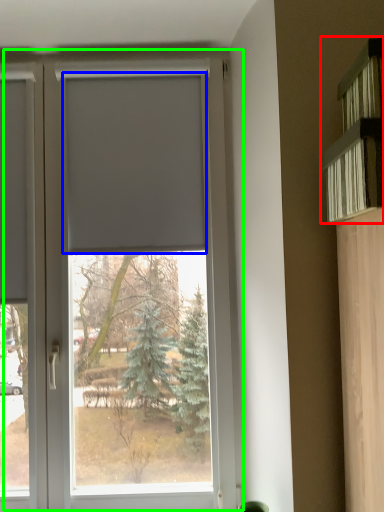
Question: Which object is the farthest from shelf (highlighted by a red box)? Choose among these: blind (highlighted by a blue box) or window (highlighted by a green box).

Choices:
 (A) blind
 (B) window

Answer: (B)